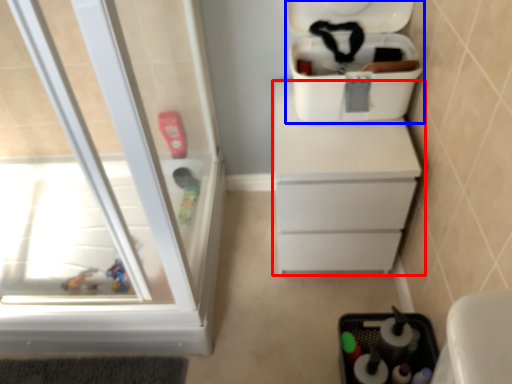
Question: Which point is further to the camera, chest of drawers (highlighted by a red box) or cooler (highlighted by a blue box)?

Choices:
 (A) chest of drawers
 (B) cooler

Answer: (A)